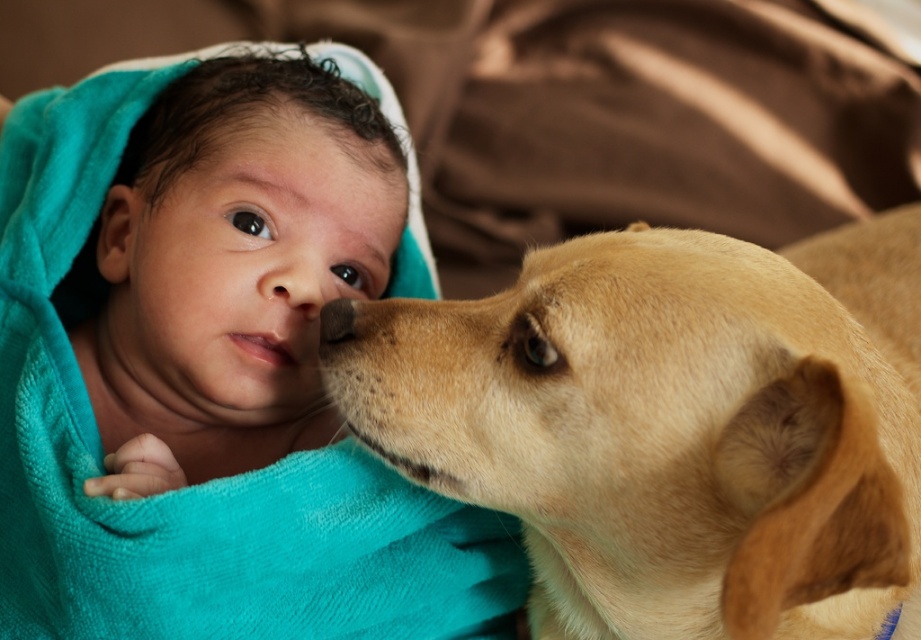
Is point (193, 518) positioned in front of point (322, 259)?

Yes, point (193, 518) is closer to viewer.

At what (x,y) coordinates should I click in order to perform the action: click on turquoise towel wrapped baby at center. Please return your answer as a coordinate pair (x, y). The height and width of the screenshot is (640, 921). Looking at the image, I should click on (200, 484).

Between light brown fur dog at center and turquoise towel wrapped baby at center, which one has more height?

turquoise towel wrapped baby at center is taller.

The image size is (921, 640). What do you see at coordinates (671, 426) in the screenshot?
I see `light brown fur dog at center` at bounding box center [671, 426].

Identify the location of light brown fur dog at center. The image size is (921, 640). (671, 426).

Can you confirm if light brown fur dog at center is taller than smooth beige nose at center?

Indeed, light brown fur dog at center has a greater height compared to smooth beige nose at center.

Which of these two, light brown fur dog at center or smooth beige nose at center, stands taller?

light brown fur dog at center is taller.

Is point (785, 403) more distant than point (293, 308)?

No, (785, 403) is in front of (293, 308).

You are a GUI agent. You are given a task and a screenshot of the screen. Output one action in this format:
    pyautogui.click(x=<x>, y=<y>)
    Task: Click on the light brown fur dog at center
    The image size is (921, 640).
    Given the screenshot: What is the action you would take?
    pyautogui.click(x=671, y=426)